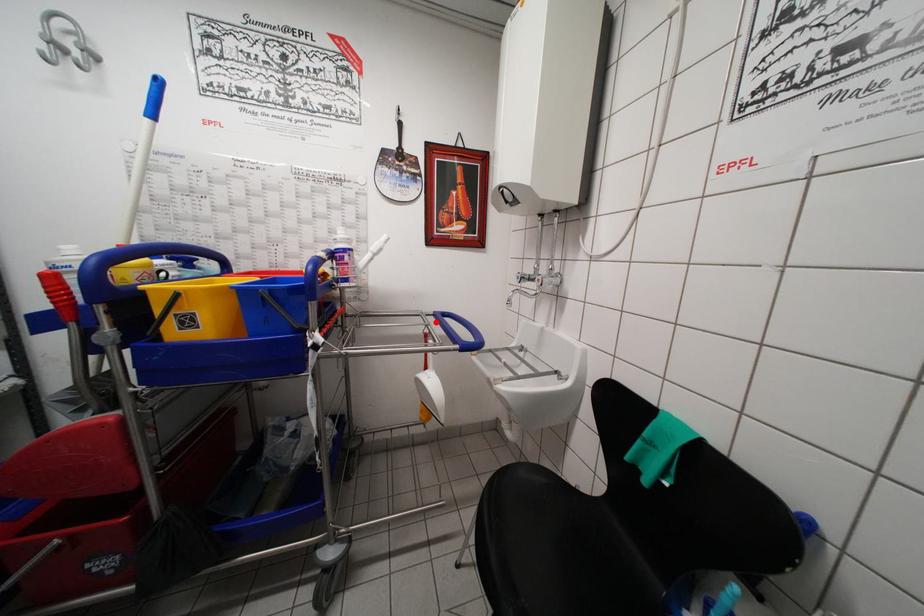
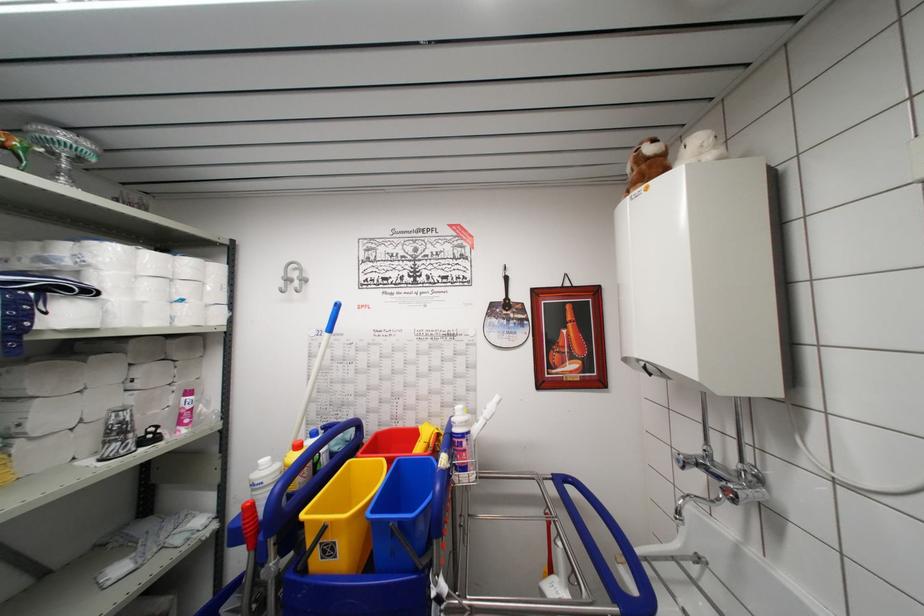
Locate, in the second image, the point that corresponds to the highlighted location in the first image.

(554, 487)